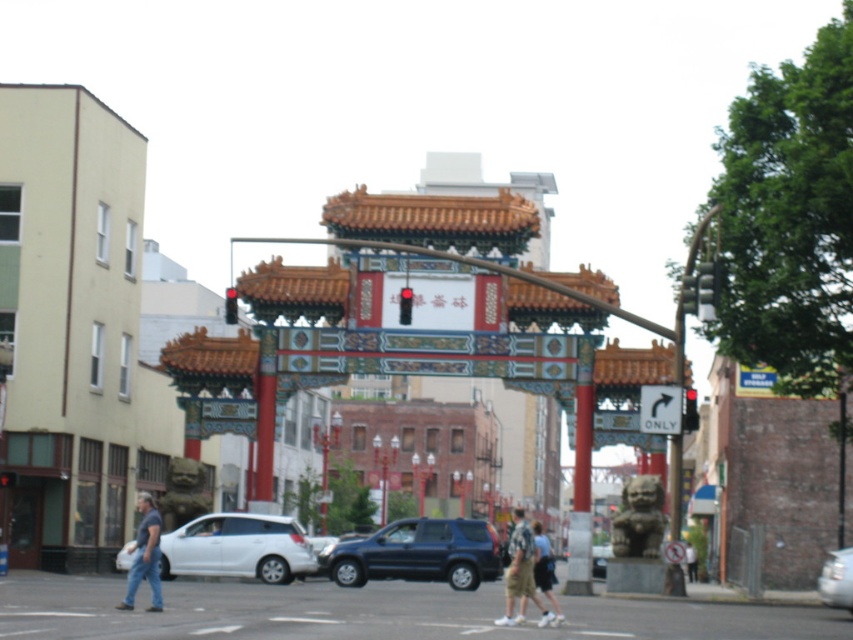
You are a delivery person who needs to park your 6 feet tall delivery van. You see the white matte car at center and the black glass door at lower left. Which object is taller, and can you safely park your van without hitting anything?

The white matte car at center is much taller than the black glass door at lower left. Since your delivery van is 6 feet tall, you should avoid parking near the white matte car at center to prevent hitting the taller object.

You are a delivery driver who needs to park your vehicle between two other cars on the street. Your vehicle is the same size as the white matte car at center. Can you fit your vehicle between the matte black suv at center and another car parked nearby?

The matte black suv at center is narrower than the white matte car at center. Since your vehicle is the same size as the white matte car at center, you can fit it between the matte black suv at center and another car as long as there is enough space available.

You are a pedestrian standing at the crosswalk and want to reach the black glass door at lower left. Is the white matte car at center blocking your path?

The white matte car at center is in front of the black glass door at lower left, so it is blocking your path to the black glass door at lower left.